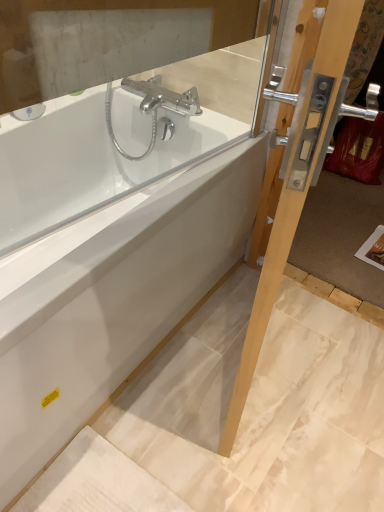
Question: Considering the relative positions of white glossy bathtub at center and clear glass screen door at right in the image provided, is white glossy bathtub at center to the left of clear glass screen door at right from the viewer's perspective?

Choices:
 (A) no
 (B) yes

Answer: (B)

Question: Can you confirm if white glossy bathtub at center is taller than clear glass screen door at right?

Choices:
 (A) yes
 (B) no

Answer: (B)

Question: From a real-world perspective, is white glossy bathtub at center located beneath clear glass screen door at right?

Choices:
 (A) no
 (B) yes

Answer: (B)

Question: Is white glossy bathtub at center thinner than clear glass screen door at right?

Choices:
 (A) no
 (B) yes

Answer: (A)

Question: Is the depth of white glossy bathtub at center greater than that of clear glass screen door at right?

Choices:
 (A) no
 (B) yes

Answer: (B)

Question: Considering the relative positions of white glossy bathtub at center and clear glass screen door at right in the image provided, is white glossy bathtub at center to the right of clear glass screen door at right from the viewer's perspective?

Choices:
 (A) yes
 (B) no

Answer: (B)

Question: Is clear glass screen door at right positioned behind white glossy bathtub at center?

Choices:
 (A) no
 (B) yes

Answer: (A)

Question: Considering the relative positions of clear glass screen door at right and white glossy bathtub at center in the image provided, is clear glass screen door at right to the left of white glossy bathtub at center from the viewer's perspective?

Choices:
 (A) no
 (B) yes

Answer: (A)

Question: From a real-world perspective, does clear glass screen door at right stand above white glossy bathtub at center?

Choices:
 (A) no
 (B) yes

Answer: (B)

Question: Is clear glass screen door at right beside white glossy bathtub at center?

Choices:
 (A) yes
 (B) no

Answer: (B)

Question: Does clear glass screen door at right lie in front of white glossy bathtub at center?

Choices:
 (A) no
 (B) yes

Answer: (B)

Question: Considering the relative sizes of clear glass screen door at right and white glossy bathtub at center in the image provided, is clear glass screen door at right taller than white glossy bathtub at center?

Choices:
 (A) yes
 (B) no

Answer: (A)

Question: From a real-world perspective, is white glossy bathtub at center physically located above or below clear glass screen door at right?

Choices:
 (A) above
 (B) below

Answer: (B)